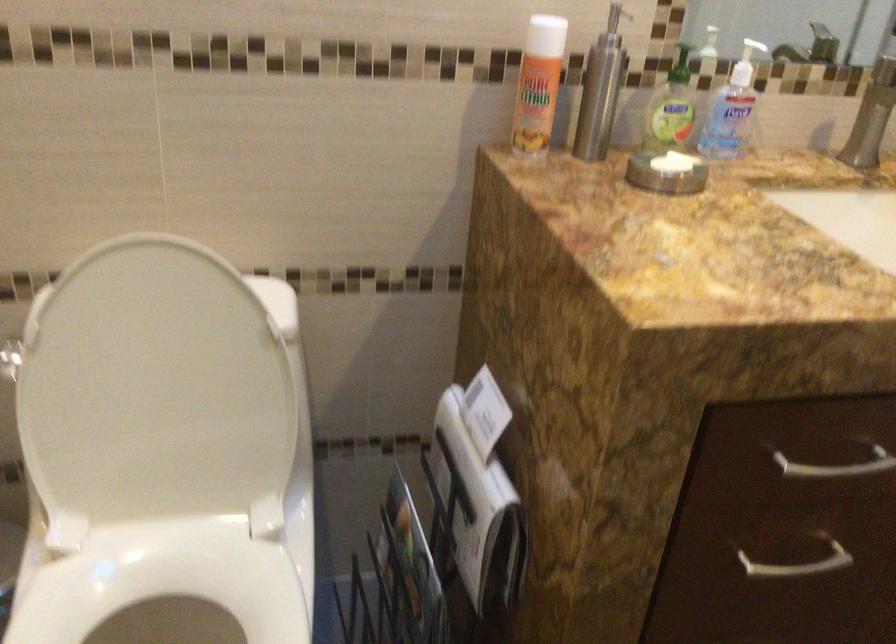
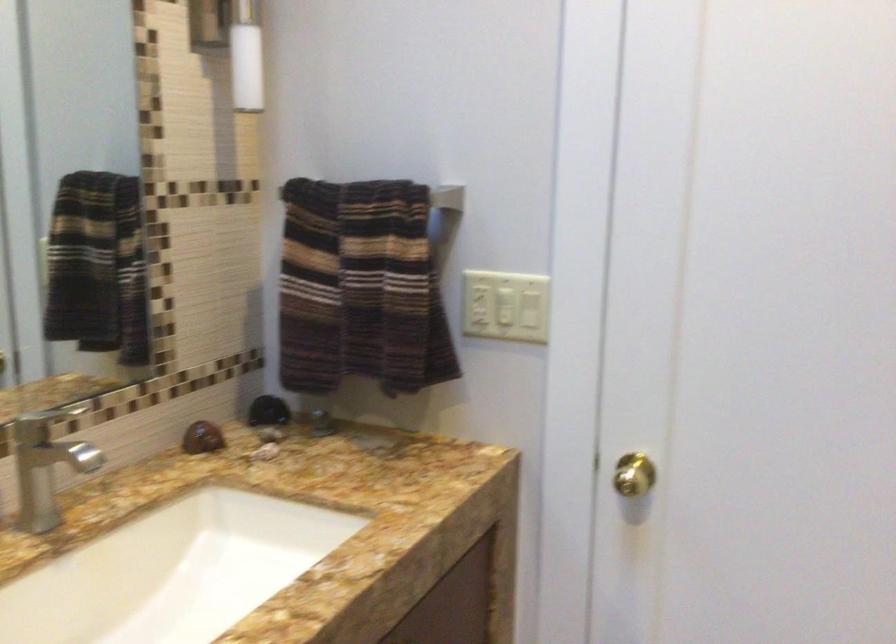
Question: The first image is from the beginning of the video and the second image is from the end. How did the camera likely rotate when shooting the video?

Choices:
 (A) Left
 (B) Right
 (C) Up
 (D) Down

Answer: (B)